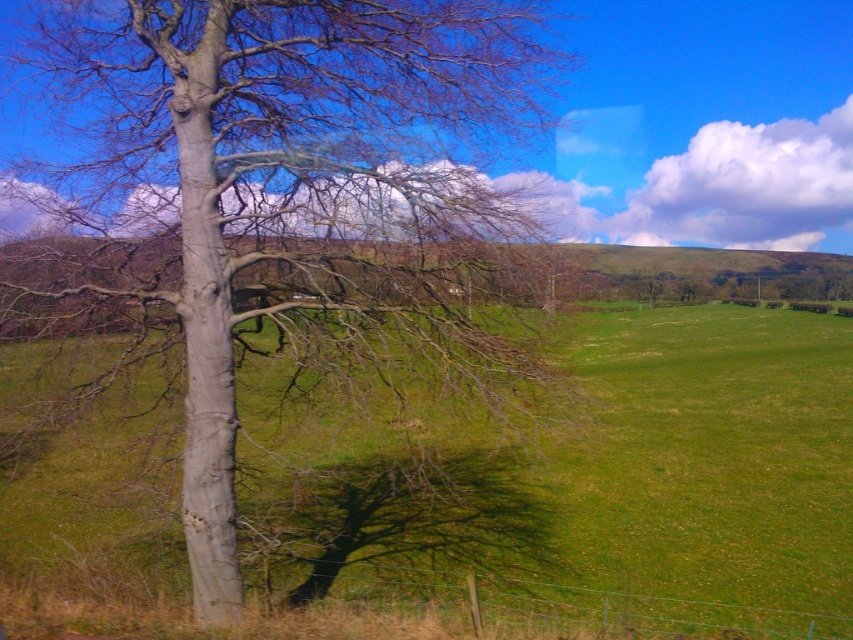
Is the position of smooth gray tree at left more distant than that of green grassy field at left?

That is True.

Does point (393, 58) come farther from viewer compared to point (746, 464)?

No, (393, 58) is in front of (746, 464).

Identify the location of smooth gray tree at left. The width and height of the screenshot is (853, 640). (279, 195).